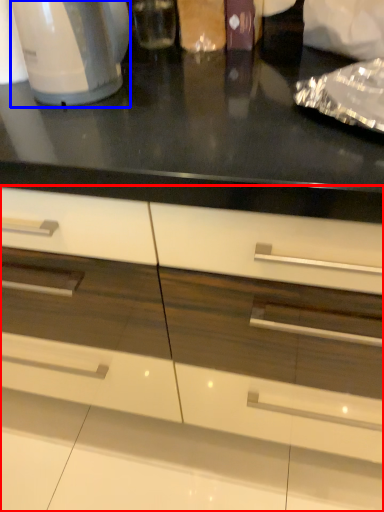
Question: Which object appears closest to the camera in this image, cabinetry (highlighted by a red box) or home appliance (highlighted by a blue box)?

Choices:
 (A) cabinetry
 (B) home appliance

Answer: (A)